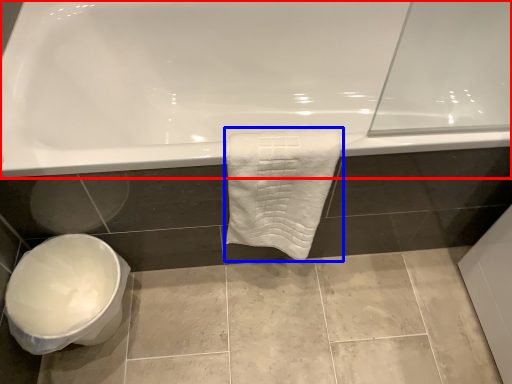
Question: Among these objects, which one is nearest to the camera, bathtub (highlighted by a red box) or towel (highlighted by a blue box)?

Choices:
 (A) bathtub
 (B) towel

Answer: (B)